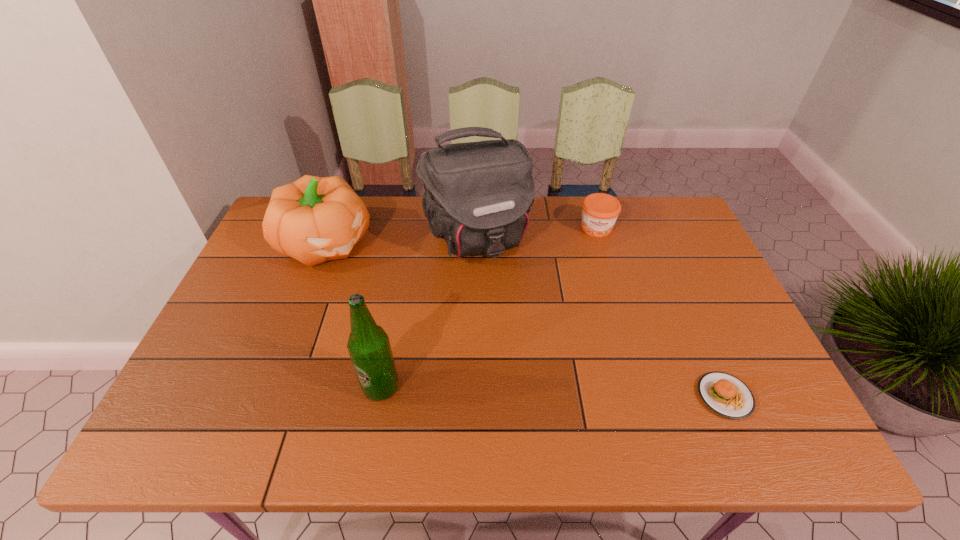
You are a GUI agent. You are given a task and a screenshot of the screen. Output one action in this format:
    pyautogui.click(x=<x>, y=<y>)
    Task: Click on the free space between the jam and the shortest object
    This screenshot has height=540, width=960.
    Given the screenshot: What is the action you would take?
    pyautogui.click(x=660, y=312)

Identify which object is the closest to the pumpkin. Please provide its 2D coordinates. Your answer should be formatted as a tuple, i.e. [(x, y)], where the tuple contains the x and y coordinates of a point satisfying the conditions above.

[(477, 197)]

Where is `object that is the fourth closest to the fourth tallest object`? The height and width of the screenshot is (540, 960). object that is the fourth closest to the fourth tallest object is located at coordinates (368, 345).

Where is `free region that satisfies the following two spatial constraints: 1. on the front side of the food; 2. on the left side of the leftmost object`? The width and height of the screenshot is (960, 540). free region that satisfies the following two spatial constraints: 1. on the front side of the food; 2. on the left side of the leftmost object is located at coordinates (267, 396).

Locate an element on the screen. blank space that satisfies the following two spatial constraints: 1. on the back side of the shoulder bag; 2. on the right side of the leftmost object is located at coordinates (327, 239).

The image size is (960, 540). Find the location of `vacant region that satisfies the following two spatial constraints: 1. on the back side of the pumpkin; 2. on the left side of the tallest object`. vacant region that satisfies the following two spatial constraints: 1. on the back side of the pumpkin; 2. on the left side of the tallest object is located at coordinates (327, 239).

Where is `vacant space that satisfies the following two spatial constraints: 1. on the label of the shortest object; 2. on the left side of the fourth shortest object`? vacant space that satisfies the following two spatial constraints: 1. on the label of the shortest object; 2. on the left side of the fourth shortest object is located at coordinates (379, 396).

The image size is (960, 540). I want to click on vacant space that satisfies the following two spatial constraints: 1. on the front side of the food; 2. on the left side of the shoulder bag, so pyautogui.click(x=476, y=396).